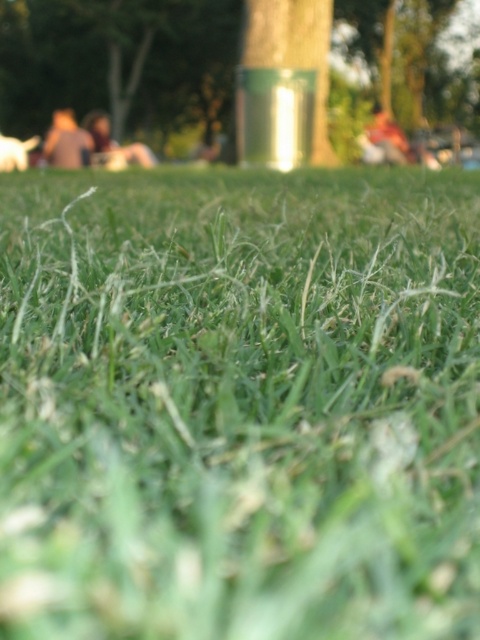
You are standing in the grassy area shown in the image. There is a point marked at coordinates (x=240, y=404). What is the color of the grass at that point?

The green grassy at center is represented by point (x=240, y=404), so the color of the grass at that point is green.

You are taking a photo with a shallow depth of field and want to focus on the green grassy at center. Will the light brown fabric person at left be in focus or out of focus?

The green grassy at center is in front of the light brown fabric person at left. Since the photo has a shallow depth of field, the light brown fabric person at left will be out of focus.